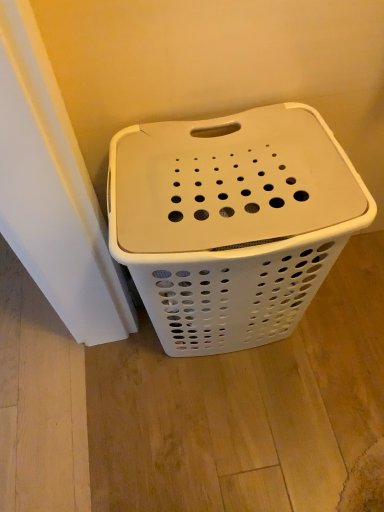
Describe the element at coordinates (231, 222) in the screenshot. I see `white plastic laundry basket at center` at that location.

Where is `white plastic laundry basket at center`? This screenshot has height=512, width=384. white plastic laundry basket at center is located at coordinates (231, 222).

You are a GUI agent. You are given a task and a screenshot of the screen. Output one action in this format:
    pyautogui.click(x=<x>, y=<y>)
    Task: Click on the white plastic laundry basket at center
    
    Given the screenshot: What is the action you would take?
    pyautogui.click(x=231, y=222)